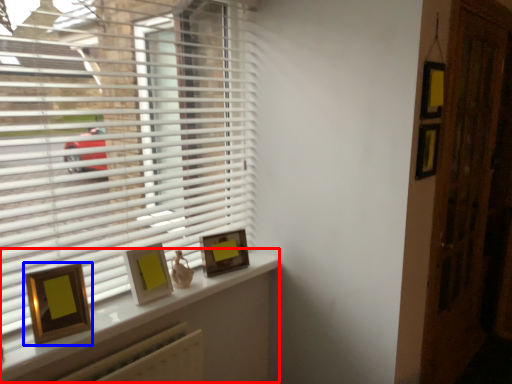
Question: Which of the following is the closest to the observer, window (highlighted by a red box) or picture frame (highlighted by a blue box)?

Choices:
 (A) window
 (B) picture frame

Answer: (A)